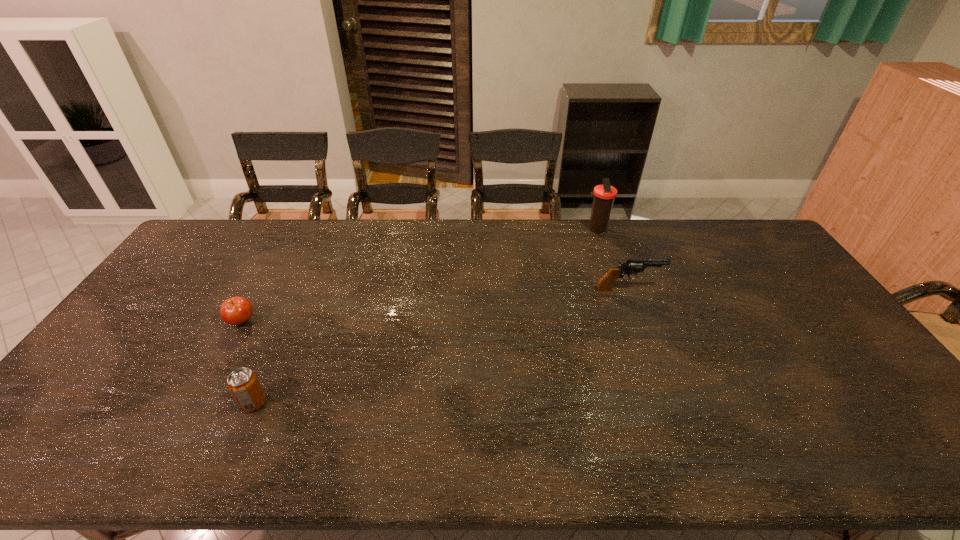
I want to click on vacant space in between the shortest object and the second shortest object, so pyautogui.click(x=248, y=362).

Where is `empty space between the third shortest object and the thermos bottle`? empty space between the third shortest object and the thermos bottle is located at coordinates (612, 260).

Locate an element on the screen. This screenshot has height=540, width=960. free space between the third farthest object and the thermos bottle is located at coordinates (420, 275).

The height and width of the screenshot is (540, 960). I want to click on free space between the second object from left to right and the third nearest object, so click(441, 346).

The height and width of the screenshot is (540, 960). Find the location of `vacant space in between the third tallest object and the second farthest object`. vacant space in between the third tallest object and the second farthest object is located at coordinates (441, 346).

The height and width of the screenshot is (540, 960). In order to click on vacant region between the nearest object and the thermos bottle in this screenshot , I will do click(x=425, y=316).

Image resolution: width=960 pixels, height=540 pixels. Find the location of `free space that is in between the third tallest object and the gun`. free space that is in between the third tallest object and the gun is located at coordinates (441, 346).

This screenshot has height=540, width=960. In order to click on blank region between the third shortest object and the second shortest object in this screenshot , I will do `click(441, 346)`.

Identify which object is the third nearest to the tallest object. Please provide its 2D coordinates. Your answer should be formatted as a tuple, i.e. [(x, y)], where the tuple contains the x and y coordinates of a point satisfying the conditions above.

[(243, 384)]

Identify which object is the third nearest to the third object from right to left. Please provide its 2D coordinates. Your answer should be formatted as a tuple, i.e. [(x, y)], where the tuple contains the x and y coordinates of a point satisfying the conditions above.

[(604, 195)]